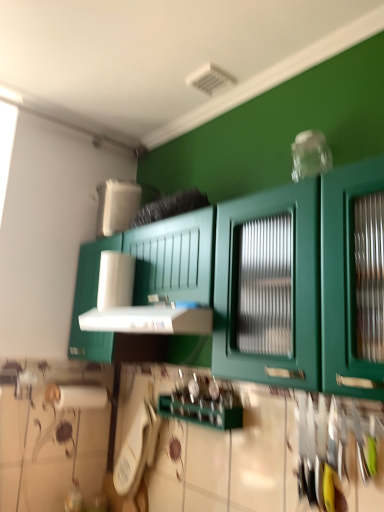
Question: Is white plastic vent at center positioned in front of white plastic phone at lower center?

Choices:
 (A) yes
 (B) no

Answer: (A)

Question: Is white plastic phone at lower center surrounded by white plastic vent at center?

Choices:
 (A) no
 (B) yes

Answer: (A)

Question: Considering the relative sizes of white plastic vent at center and white plastic phone at lower center in the image provided, is white plastic vent at center wider than white plastic phone at lower center?

Choices:
 (A) yes
 (B) no

Answer: (A)

Question: From a real-world perspective, does white plastic vent at center sit lower than white plastic phone at lower center?

Choices:
 (A) yes
 (B) no

Answer: (B)

Question: Does white plastic vent at center have a smaller size compared to white plastic phone at lower center?

Choices:
 (A) no
 (B) yes

Answer: (A)

Question: Is green matte cabinet at center to the left or to the right of white plastic vent at center in the image?

Choices:
 (A) right
 (B) left

Answer: (A)

Question: Considering the positions of green matte cabinet at center and white plastic vent at center in the image, is green matte cabinet at center bigger or smaller than white plastic vent at center?

Choices:
 (A) big
 (B) small

Answer: (A)

Question: Would you say green matte cabinet at center is inside or outside white plastic vent at center?

Choices:
 (A) outside
 (B) inside

Answer: (A)

Question: From the image's perspective, is green matte cabinet at center above or below white plastic vent at center?

Choices:
 (A) below
 (B) above

Answer: (B)

Question: Is white plastic vent at center inside the boundaries of white plastic phone at lower center, or outside?

Choices:
 (A) inside
 (B) outside

Answer: (B)

Question: Is point (152, 320) positioned closer to the camera than point (150, 439)?

Choices:
 (A) farther
 (B) closer

Answer: (B)

Question: From the image's perspective, is white plastic vent at center positioned above or below white plastic phone at lower center?

Choices:
 (A) below
 (B) above

Answer: (B)

Question: Considering the positions of white plastic vent at center and white plastic phone at lower center in the image, is white plastic vent at center bigger or smaller than white plastic phone at lower center?

Choices:
 (A) big
 (B) small

Answer: (A)

Question: In terms of height, does white plastic vent at center look taller or shorter compared to green matte cabinet at center?

Choices:
 (A) tall
 (B) short

Answer: (B)

Question: Is white plastic vent at center inside or outside of green matte cabinet at center?

Choices:
 (A) inside
 (B) outside

Answer: (A)